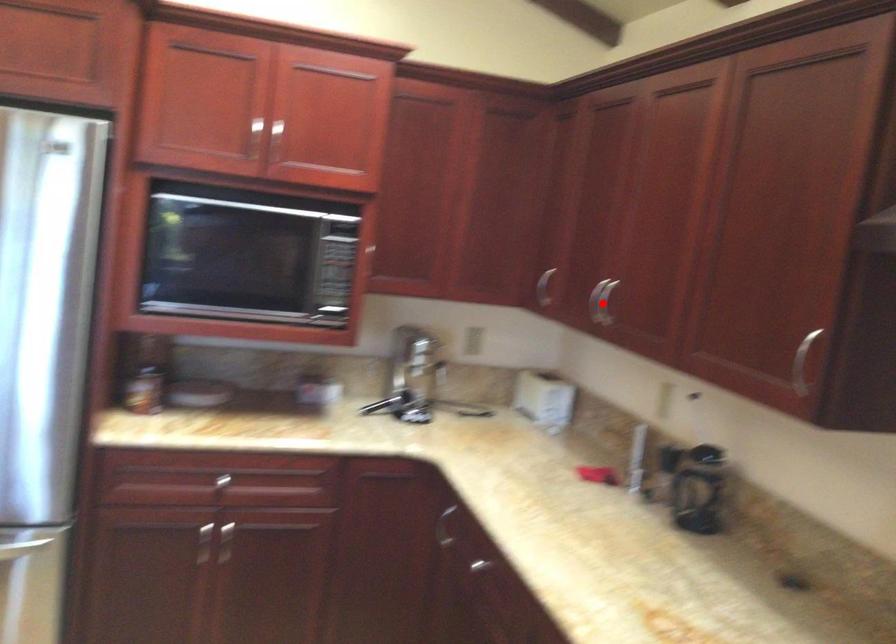
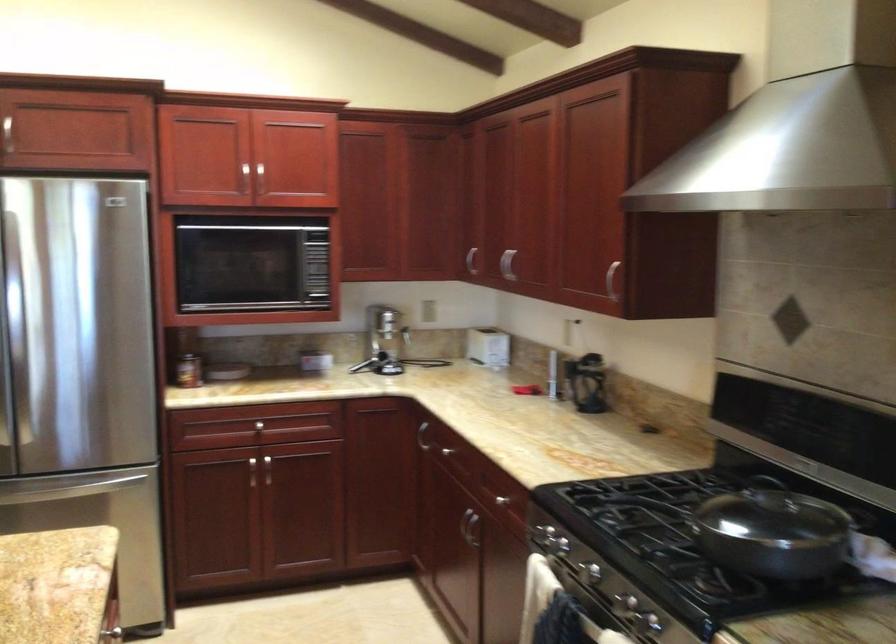
In the second image, find the point that corresponds to the highlighted location in the first image.

(506, 263)